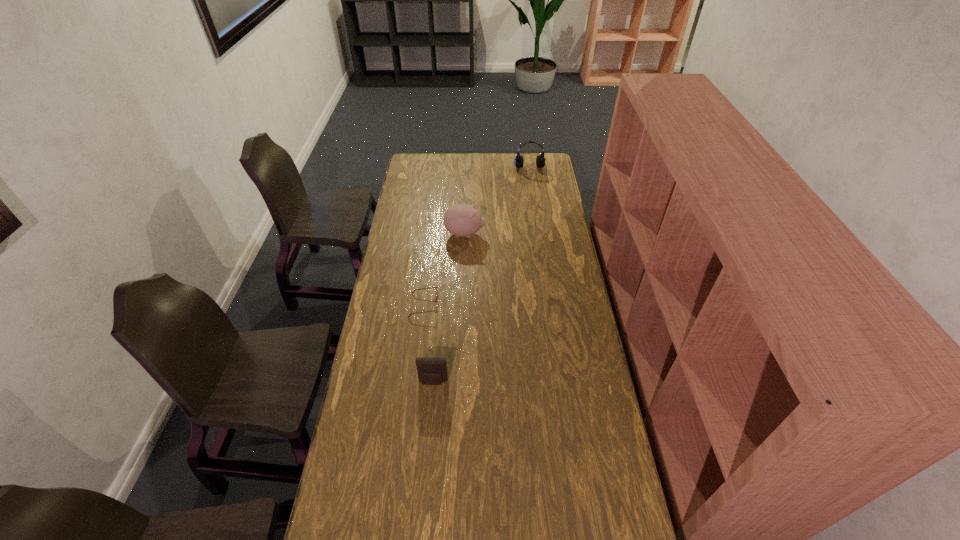
Where is `vacant region located on the face of the third farthest object`? vacant region located on the face of the third farthest object is located at coordinates (511, 305).

This screenshot has width=960, height=540. What are the coordinates of `object at the far edge` in the screenshot? It's located at (540, 160).

This screenshot has width=960, height=540. Identify the location of object situated at the left edge. (431, 287).

You are a GUI agent. You are given a task and a screenshot of the screen. Output one action in this format:
    pyautogui.click(x=<x>, y=<y>)
    Task: Click on the object at the right edge
    
    Given the screenshot: What is the action you would take?
    pyautogui.click(x=540, y=160)

Where is `object at the far right corner`? This screenshot has width=960, height=540. object at the far right corner is located at coordinates (540, 160).

At what (x,y) coordinates should I click in order to perform the action: click on blank space at the far edge of the desktop. Please return your answer as a coordinate pair (x, y). The height and width of the screenshot is (540, 960). Looking at the image, I should click on (525, 166).

The height and width of the screenshot is (540, 960). Identify the location of free space at the left edge. (392, 367).

The width and height of the screenshot is (960, 540). Identify the location of vacant space at the right edge of the desktop. (601, 456).

In the image, there is a desktop. Where is `vacant area at the far left corner`? vacant area at the far left corner is located at coordinates (411, 170).

Where is `vacant area at the far right corner of the desktop`? Image resolution: width=960 pixels, height=540 pixels. vacant area at the far right corner of the desktop is located at coordinates (536, 158).